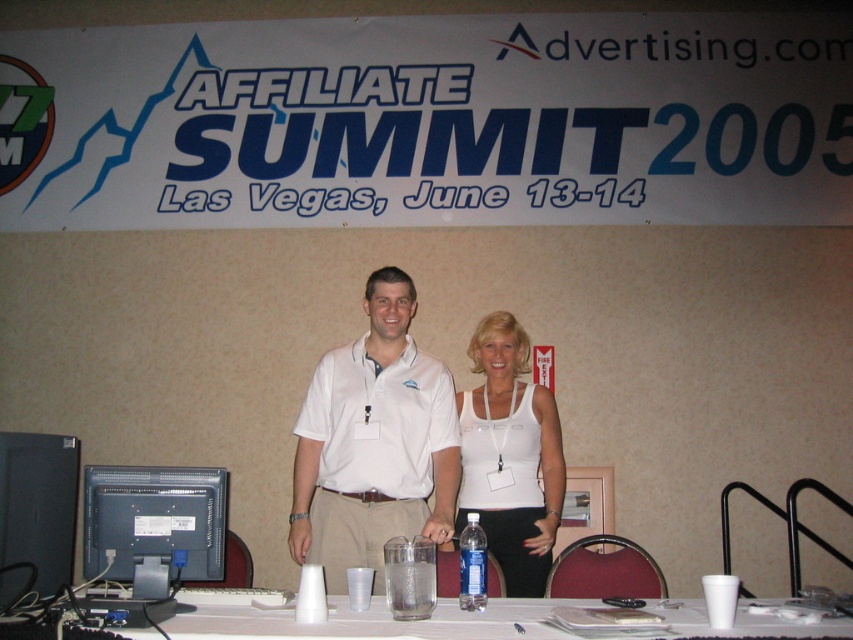
Question: Where is white matte tank top at center located in relation to metallic silver bulletin board at center in the image?

Choices:
 (A) right
 (B) left

Answer: (B)

Question: Which point appears closest to the camera in this image?

Choices:
 (A) (492, 627)
 (B) (74, 536)
 (C) (337, 577)

Answer: (A)

Question: Is white cotton polo shirt at center wider than black plastic monitor at left?

Choices:
 (A) yes
 (B) no

Answer: (A)

Question: Among these points, which one is nearest to the camera?

Choices:
 (A) (364, 515)
 (B) (543, 508)

Answer: (A)

Question: From the image, what is the correct spatial relationship of white plastic cups at lower center in relation to metallic silver bulletin board at center?

Choices:
 (A) below
 (B) above

Answer: (B)

Question: Which is farther from the matte gray monitor at lower left?

Choices:
 (A) metallic silver bulletin board at center
 (B) white matte tank top at center
 (C) white plastic cups at lower center

Answer: (A)